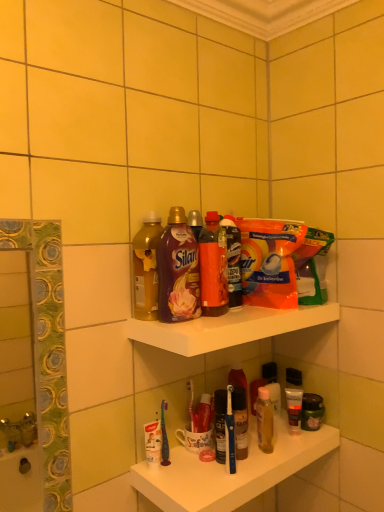
Image resolution: width=384 pixels, height=512 pixels. What are the coordinates of `vacant area that is in front of matte plastic bottle at upper center, marked as the second bottle in a left-to-right arrangement` in the screenshot? It's located at (185, 326).